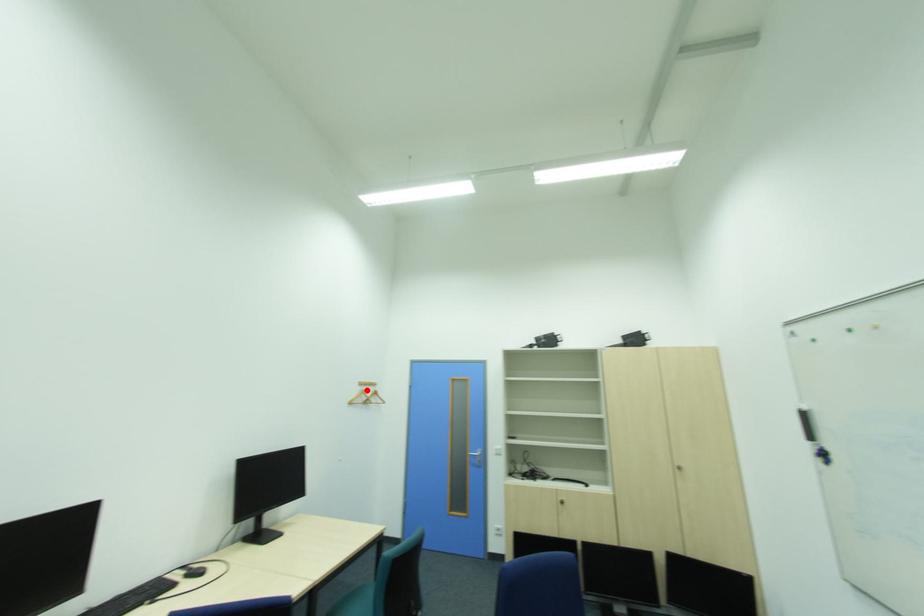
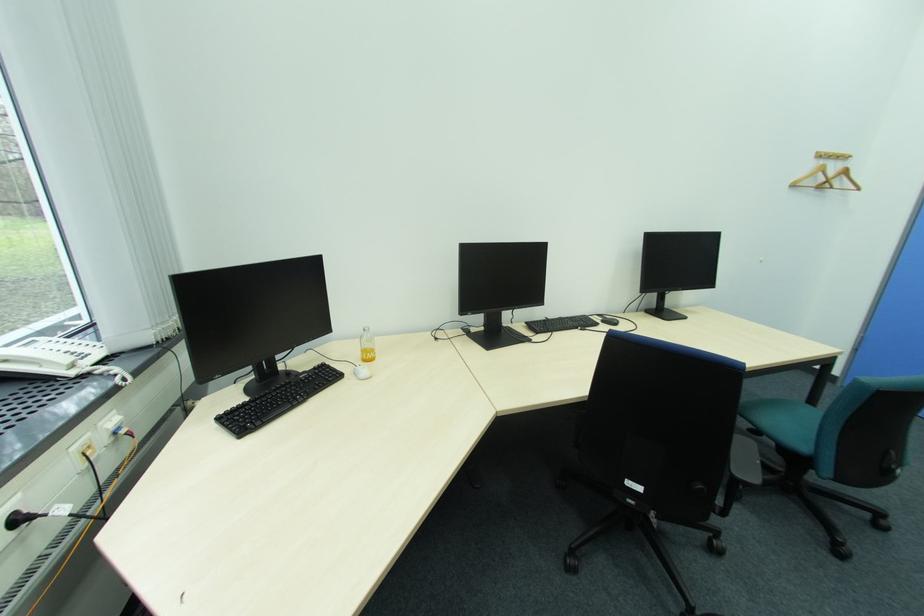
Locate, in the second image, the point that corresponds to the highlighted location in the first image.

(819, 164)